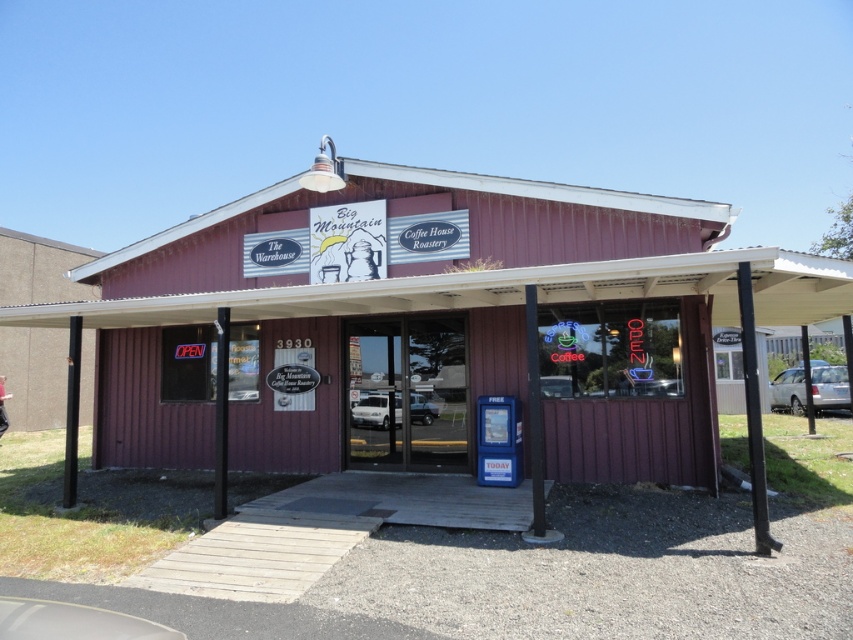
Question: Considering the real-world distances, which object is closest to the white matte van at center?

Choices:
 (A) white matte car at center
 (B) satin silver sedan at right
 (C) wooden paneling at center

Answer: (A)

Question: Is satin silver sedan at right closer to the viewer compared to white matte van at center?

Choices:
 (A) yes
 (B) no

Answer: (B)

Question: Can you confirm if satin silver sedan at right is thinner than white matte van at center?

Choices:
 (A) yes
 (B) no

Answer: (B)

Question: Which object is closer to the camera taking this photo?

Choices:
 (A) satin silver sedan at right
 (B) white matte van at center
 (C) wooden paneling at center
 (D) white matte car at center

Answer: (C)

Question: Among these points, which one is farthest from the camera?

Choices:
 (A) (415, 392)
 (B) (393, 417)
 (C) (422, 266)

Answer: (B)

Question: Can you confirm if wooden paneling at center is bigger than white matte car at center?

Choices:
 (A) yes
 (B) no

Answer: (A)